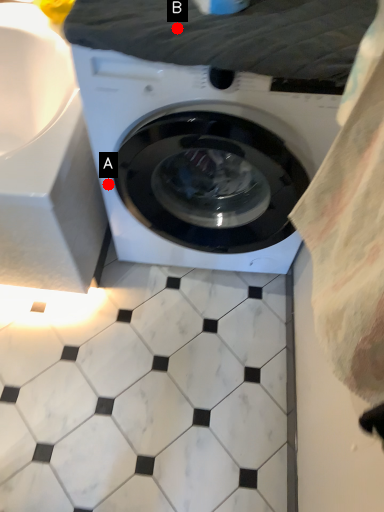
Question: Two points are circled on the image, labeled by A and B beside each circle. Which point is further to the camera?

Choices:
 (A) A is further
 (B) B is further

Answer: (A)